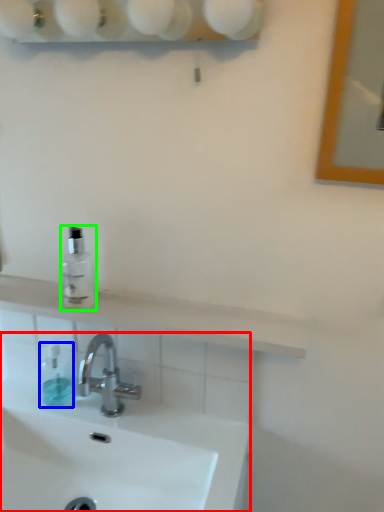
Question: Based on their relative distances, which object is nearer to sink (highlighted by a red box)? Choose from toiletry (highlighted by a blue box) and mouthwash (highlighted by a green box).

Choices:
 (A) toiletry
 (B) mouthwash

Answer: (A)